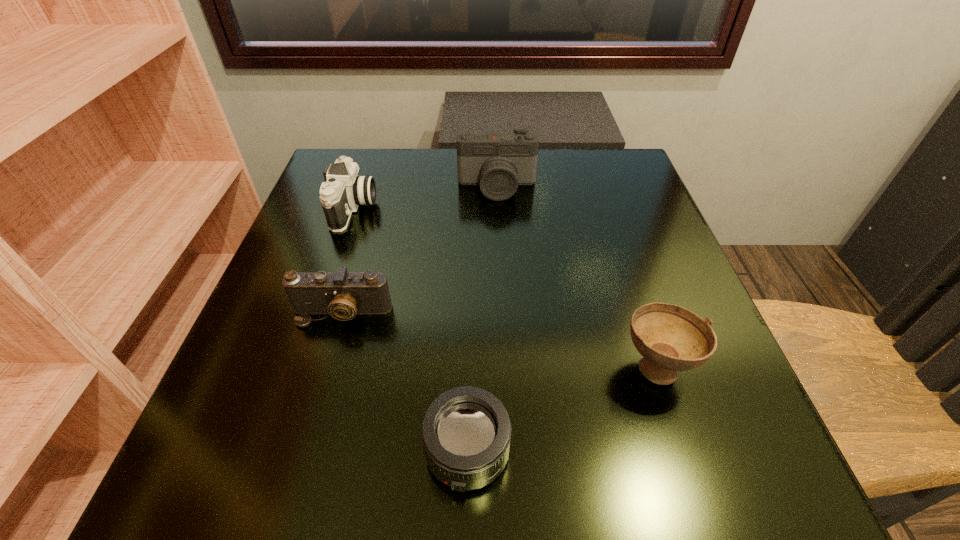
This screenshot has height=540, width=960. I want to click on object located in the right edge section of the desktop, so click(670, 338).

Identify the location of object at the far left corner. Image resolution: width=960 pixels, height=540 pixels. (344, 190).

In the image, there is a desktop. Where is `free space at the far edge`? The height and width of the screenshot is (540, 960). free space at the far edge is located at coordinates (537, 193).

This screenshot has width=960, height=540. Identify the location of free space at the near edge. (332, 467).

Find the location of `free space at the right edge of the desktop`. free space at the right edge of the desktop is located at coordinates (636, 220).

Find the location of a particular element. The width and height of the screenshot is (960, 540). vacant area at the far left corner is located at coordinates (336, 148).

Locate an element on the screen. free space at the near left corner of the desktop is located at coordinates (181, 481).

You are a GUI agent. You are given a task and a screenshot of the screen. Output one action in this format:
    pyautogui.click(x=<x>, y=<y>)
    Task: Click on the free space at the far right corner
    Image resolution: width=960 pixels, height=540 pixels.
    Given the screenshot: What is the action you would take?
    pyautogui.click(x=611, y=176)

The height and width of the screenshot is (540, 960). I want to click on blank space at the near right corner, so click(x=775, y=497).

This screenshot has width=960, height=540. Identify the location of unoccupied position between the shortest camera and the nearest object. (405, 383).